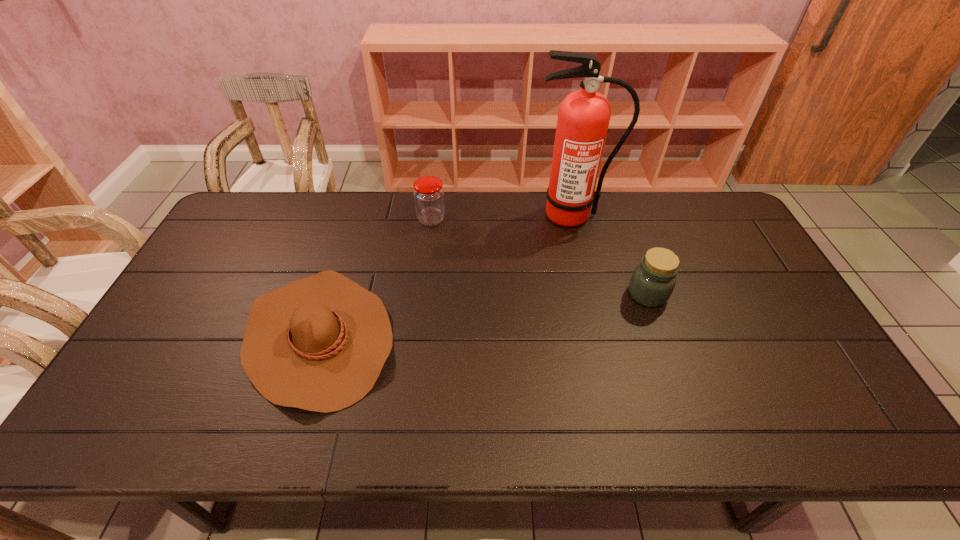
You are a GUI agent. You are given a task and a screenshot of the screen. Output one action in this format:
    pyautogui.click(x=<x>, y=<y>)
    Task: Click on the object that stands as the closest to the left jar
    This screenshot has width=960, height=540.
    Given the screenshot: What is the action you would take?
    (319, 344)

Identify the location of free space in the image that satisfies the following two spatial constraints: 1. on the back side of the second object from left to right; 2. on the right side of the cowboy hat. (355, 219).

Where is `vacant space that satisfies the following two spatial constraints: 1. on the back side of the leftmost object; 2. on the right side of the farther jar`? vacant space that satisfies the following two spatial constraints: 1. on the back side of the leftmost object; 2. on the right side of the farther jar is located at coordinates (355, 219).